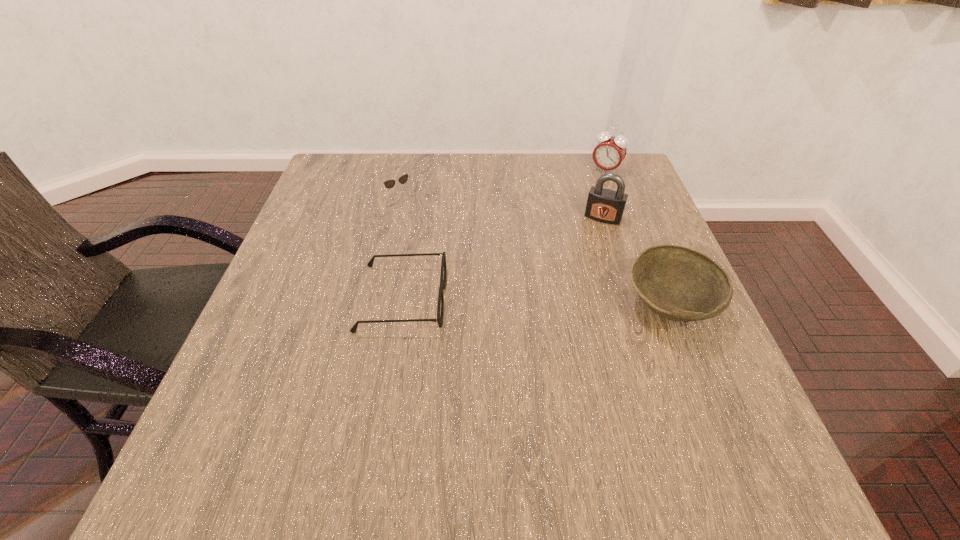
Image resolution: width=960 pixels, height=540 pixels. I want to click on alarm clock positioned at the right edge, so click(609, 153).

Locate an element on the screen. padlock located in the right edge section of the desktop is located at coordinates (604, 205).

You are a GUI agent. You are given a task and a screenshot of the screen. Output one action in this format:
    pyautogui.click(x=<x>, y=<y>)
    Task: Click on the object present at the far left corner
    The image size is (960, 540).
    Given the screenshot: What is the action you would take?
    pyautogui.click(x=389, y=184)

Identify the location of object present at the far right corner. (609, 153).

Find the location of a particular element. The image size is (960, 540). vacant space at the far edge of the desktop is located at coordinates (436, 178).

In order to click on vacant area at the near edge of the desktop in this screenshot , I will do `click(585, 406)`.

The height and width of the screenshot is (540, 960). I want to click on free space at the left edge of the desktop, so click(x=296, y=376).

This screenshot has height=540, width=960. In the image, there is a desktop. Identify the location of vacant space at the right edge. (616, 266).

In the image, there is a desktop. Where is `free space at the far left corner`? The image size is (960, 540). free space at the far left corner is located at coordinates (332, 186).

The image size is (960, 540). I want to click on vacant space at the far right corner of the desktop, so click(x=612, y=185).